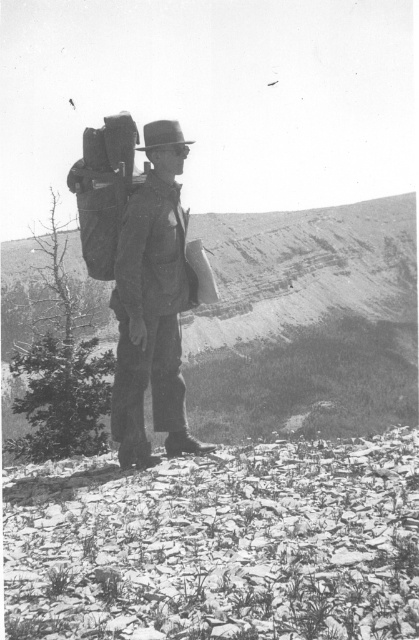
You are a hiker trying to navigate through the mountainous terrain shown in the image. You have a map in hand and see the point marked at coordinates (x=305, y=321). What type of terrain does this point indicate?

The point marked at coordinates (x=305, y=321) indicates a smooth dirt hillside at center.

You are a hiker who needs to cross the smooth dirt hillside at center. Your destination is a cabin located 200 feet away from the rugged canvas backpack at center. Can you reach the cabin without walking on the hillside?

The smooth dirt hillside at center is 182.89 feet away from the rugged canvas backpack at center. Since the cabin is 200 feet away from the rugged canvas backpack at center, you can reach the cabin without walking on the hillside by going around it.

You are a hiker who wants to climb the smooth dirt hillside at center. You have a rugged canvas backpack at center. Can you tell me which one is taller between the two?

The smooth dirt hillside at center is taller than the rugged canvas backpack at center.